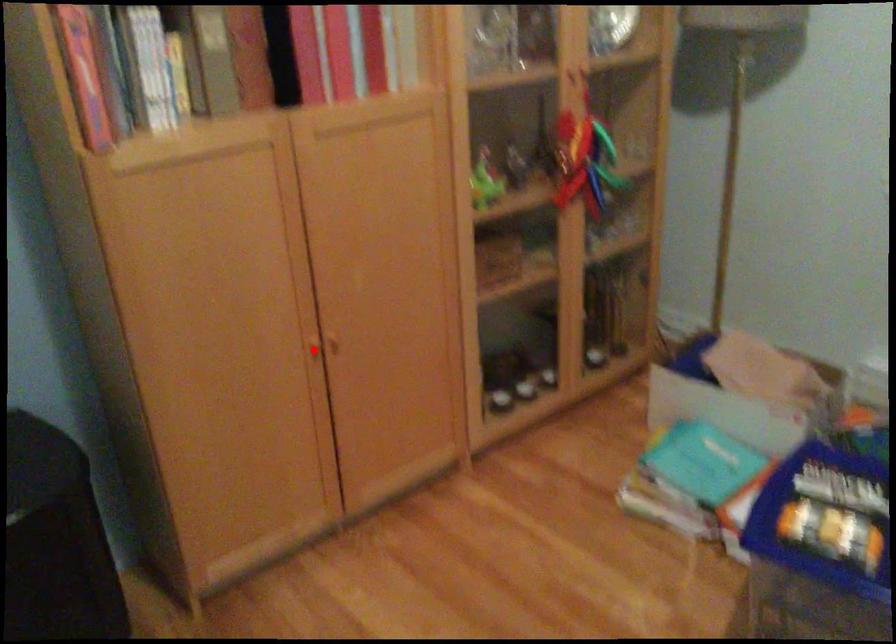
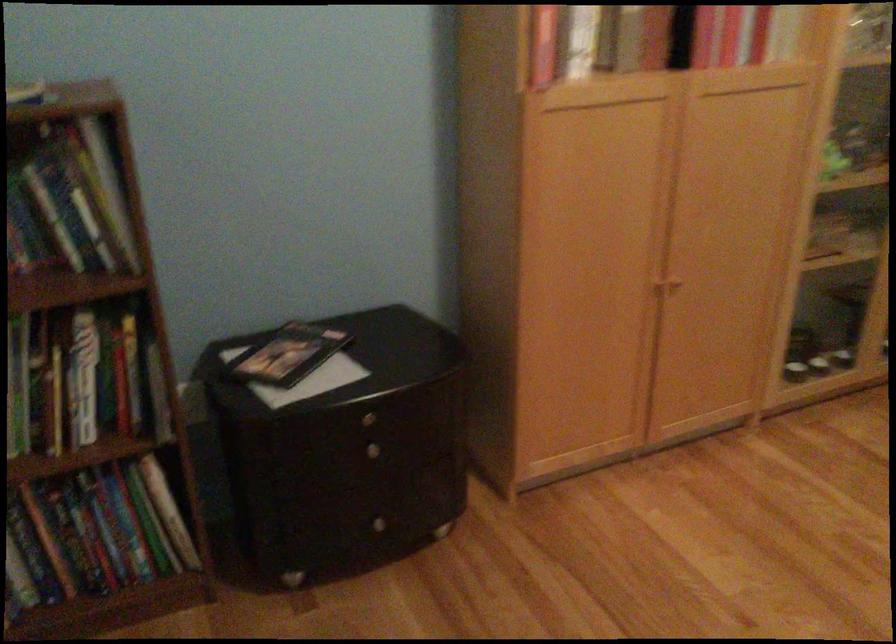
Question: I am providing you with two images of the same scene from different viewpoints. A red point is shown in image1. For the corresponding object point in image2, is it positioned nearer or farther from the camera?

Choices:
 (A) Nearer
 (B) Farther

Answer: (B)